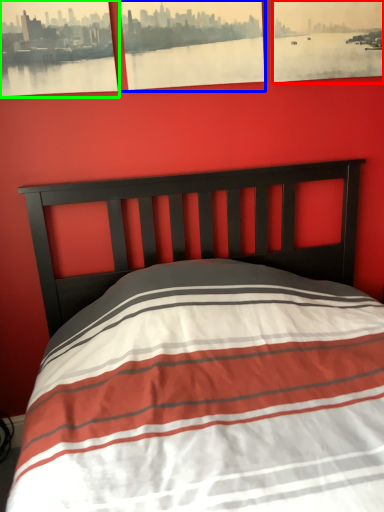
Question: Which object is the closest to the picture frame (highlighted by a red box)? Choose among these: picture frame (highlighted by a blue box) or picture frame (highlighted by a green box).

Choices:
 (A) picture frame
 (B) picture frame

Answer: (A)